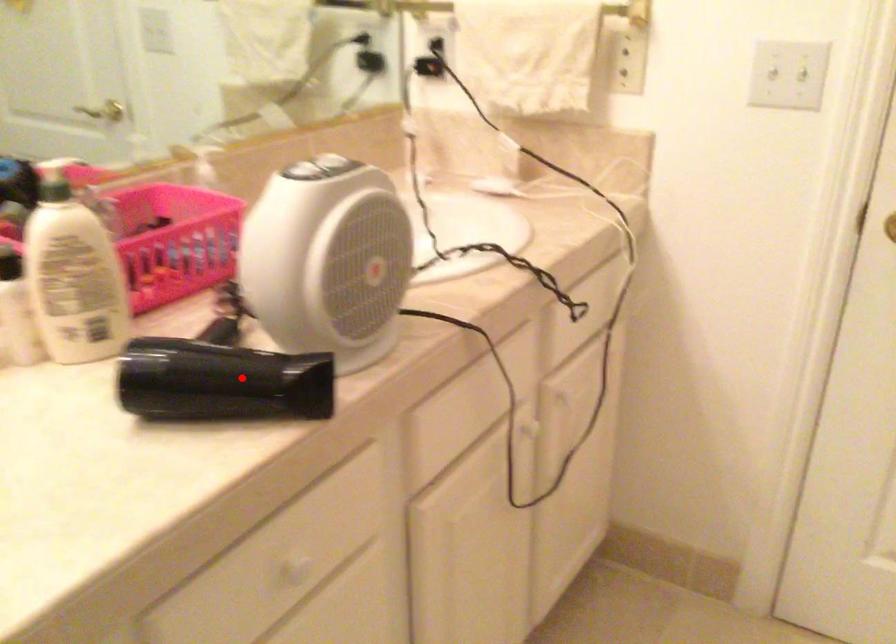
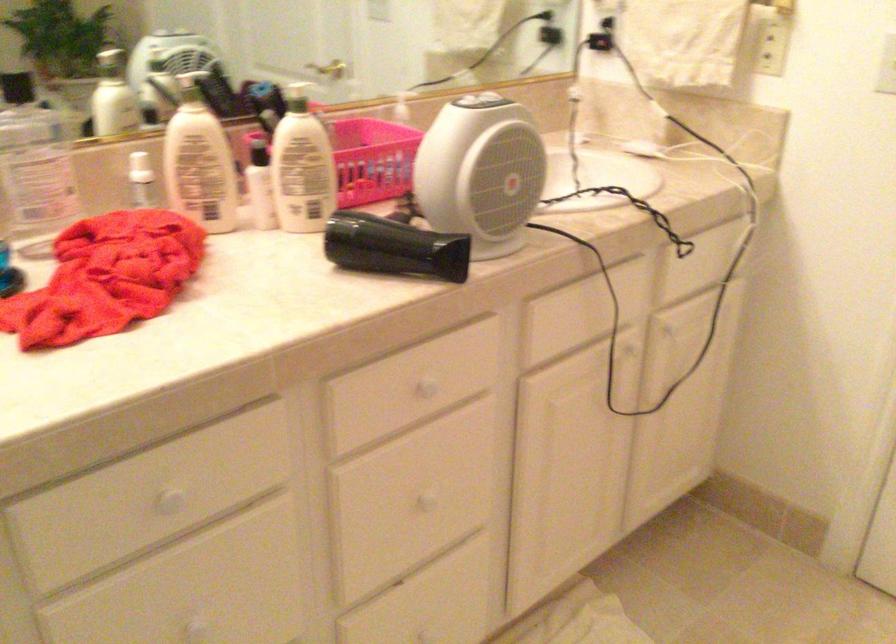
Question: I am providing you with two images of the same scene from different viewpoints. Given a red point in image1, look at the same physical point in image2. Is it:

Choices:
 (A) Closer to the viewpoint
 (B) Farther from the viewpoint

Answer: (B)